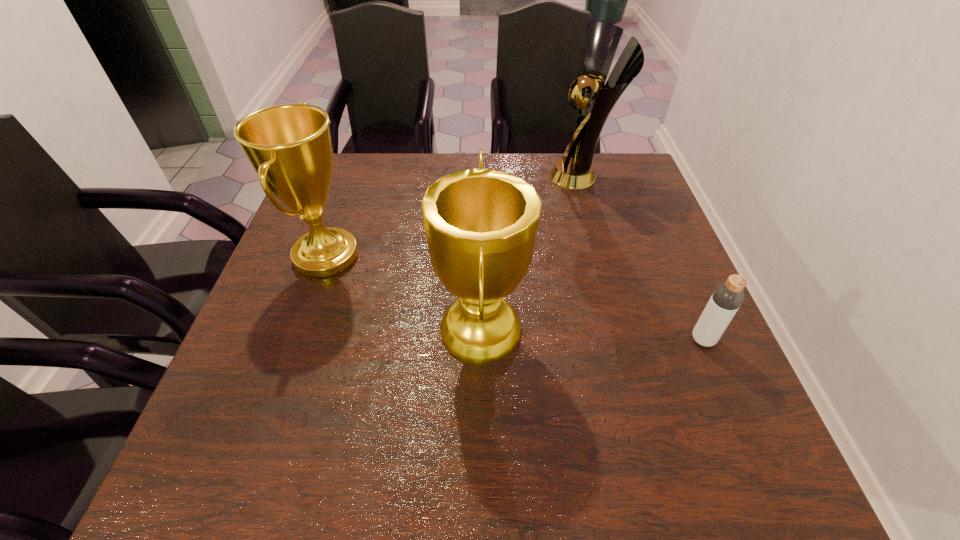
This screenshot has height=540, width=960. I want to click on vacant space at the near edge of the desktop, so click(x=619, y=450).

Image resolution: width=960 pixels, height=540 pixels. Find the location of `free space at the left edge of the desktop`. free space at the left edge of the desktop is located at coordinates (347, 215).

Where is `vacant space at the far left corner of the desktop`? The height and width of the screenshot is (540, 960). vacant space at the far left corner of the desktop is located at coordinates (358, 192).

I want to click on vacant position at the far right corner of the desktop, so click(630, 153).

Identify the location of vacant space at the near right corner. This screenshot has width=960, height=540. (719, 467).

Locate an element on the screen. free space that is in between the farthest award and the shortest object is located at coordinates (642, 258).

You are a GUI agent. You are given a task and a screenshot of the screen. Output one action in this format:
    pyautogui.click(x=<x>, y=<y>)
    Task: Click on the vacant area that lies between the leftmost award and the third object from right to left
    The height and width of the screenshot is (540, 960).
    Given the screenshot: What is the action you would take?
    pyautogui.click(x=403, y=294)

Where is `free space between the leftmost award and the third object from right to left`? free space between the leftmost award and the third object from right to left is located at coordinates (403, 294).

Identify the location of free space between the leftmost award and the bottle. (515, 298).

This screenshot has height=540, width=960. Identify the location of vacant region between the second award from right to left and the leftmost award. (403, 294).